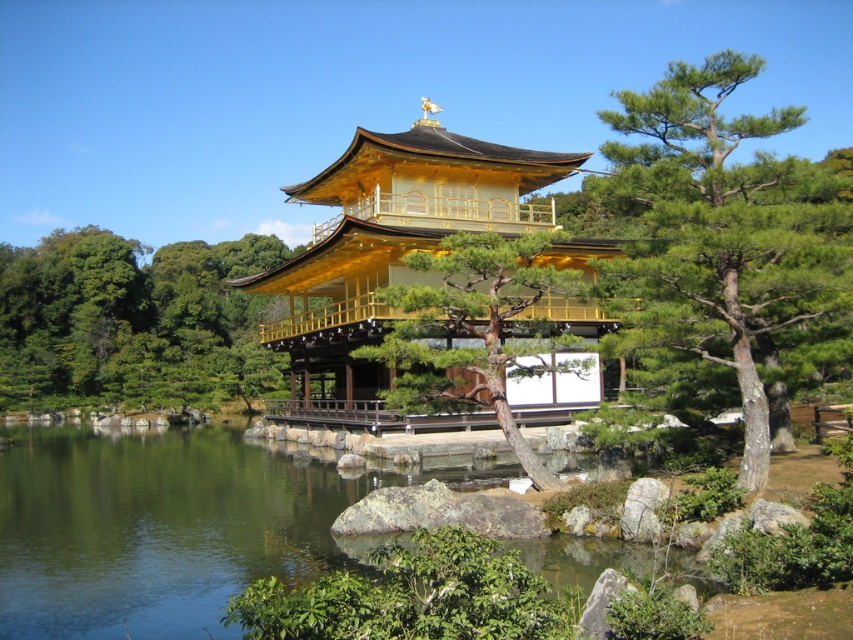
Is green leafy tree at center closer to the viewer compared to smooth bark pine tree at center?

No, green leafy tree at center is further to the viewer.

Is point (189, 314) positioned in front of point (514, 422)?

No, (189, 314) is behind (514, 422).

Identify the location of green leafy tree at center. This screenshot has height=640, width=853. (132, 321).

Does green textured pine tree at upper right have a larger size compared to golden polished wood temple at center?

Incorrect, green textured pine tree at upper right is not larger than golden polished wood temple at center.

Consider the image. Does green textured pine tree at upper right have a greater height compared to golden polished wood temple at center?

In fact, green textured pine tree at upper right may be shorter than golden polished wood temple at center.

At what (x,y) coordinates should I click in order to perform the action: click on green textured pine tree at upper right. Please return your answer as a coordinate pair (x, y). Image resolution: width=853 pixels, height=640 pixels. Looking at the image, I should click on (722, 232).

Who is shorter, green textured pine tree at upper right or smooth bark pine tree at center?

smooth bark pine tree at center

Is point (726, 186) less distant than point (447, 278)?

Yes.

Who is more forward, (747, 284) or (543, 248)?

Point (747, 284)

Identify the location of green textured pine tree at upper right. (722, 232).